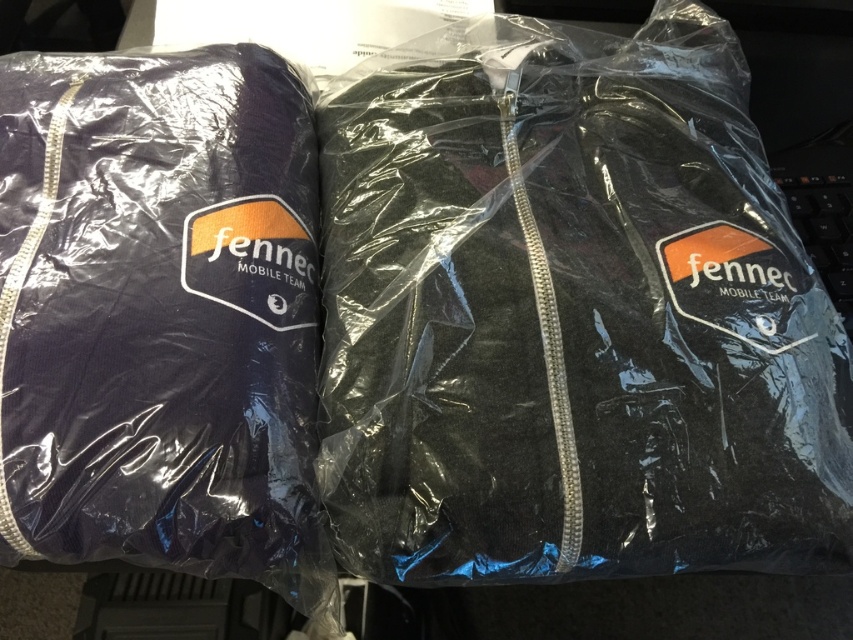
You are organizing a uniform distribution event and need to arrange the jackets in a display. If you have a shelf that is 6 inches wide, can both the matte black jacket at center and the matte black jacket at left fit side by side on it?

The distance between the matte black jacket at center and the matte black jacket at left is 5.94 inches, so they can fit side by side on a 6 inch wide shelf since the total space required is less than the shelf width.

You are organizing a uniform distribution event and need to ensure all jackets fit in a 30 cm wide storage bin. You have two jackets in front of you, the matte black jacket at center and the matte black jacket at left. Which jacket might not fit in the bin based on their widths?

The matte black jacket at center has a greater width than the matte black jacket at left, so the matte black jacket at center might not fit in the 30 cm wide storage bin if its width exceeds the bin size.

You are organizing a uniform distribution event and need to arrange two matte black jackets. You have a display stand that can only fit one jacket. If you want to place the matte black jacket at center and the matte black jacket at left on the stand, which one should you choose based on their current positions?

The matte black jacket at center is to the right of the matte black jacket at left. Since the display stand can only fit one jacket, you should choose the matte black jacket at left as it is positioned to the left of the center jacket.